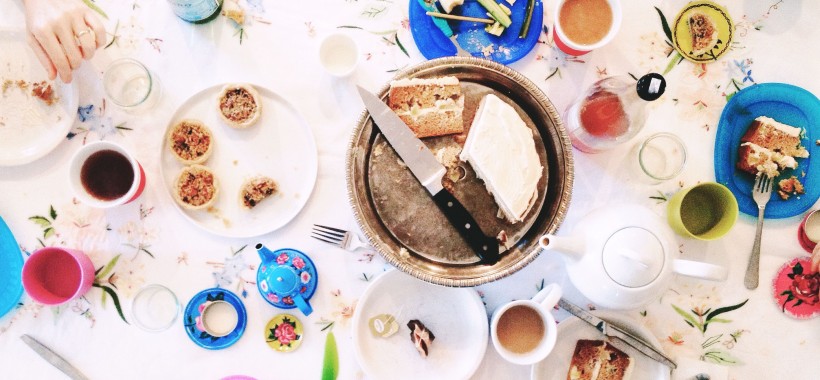
At what (x,y) coordinates should I click in order to perform the action: click on fork. Please return your answer as a coordinate pair (x, y). Image resolution: width=820 pixels, height=380 pixels. Looking at the image, I should click on (351, 247).